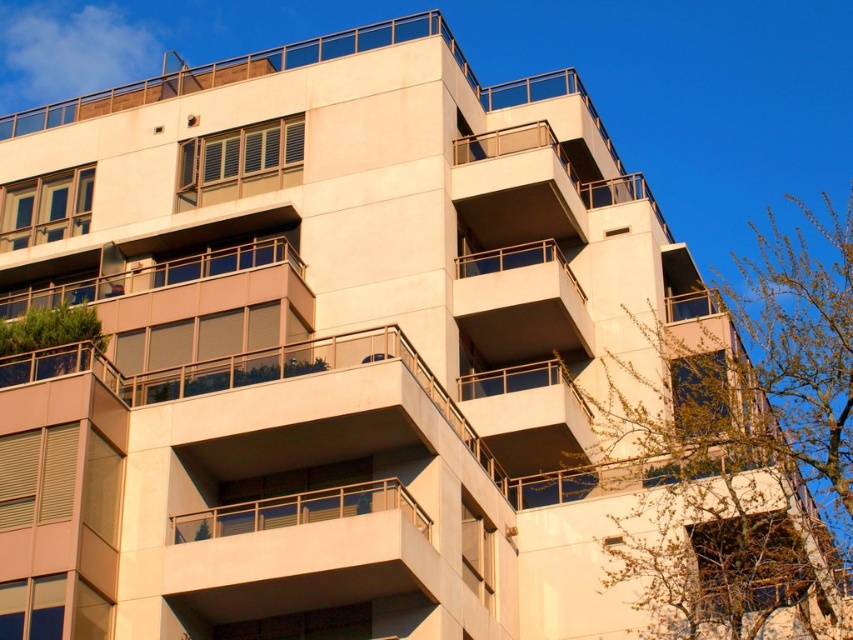
Does point (712, 630) lie behind point (80, 355)?

Yes, point (712, 630) is farther from viewer.

Can you confirm if green leafy tree at upper right is taller than green leafy tree at lower left?

Yes, green leafy tree at upper right is taller than green leafy tree at lower left.

Who is more forward, (824,467) or (16,374)?

Point (824,467) is more forward.

The image size is (853, 640). In order to click on green leafy tree at upper right in this screenshot , I will do `click(747, 451)`.